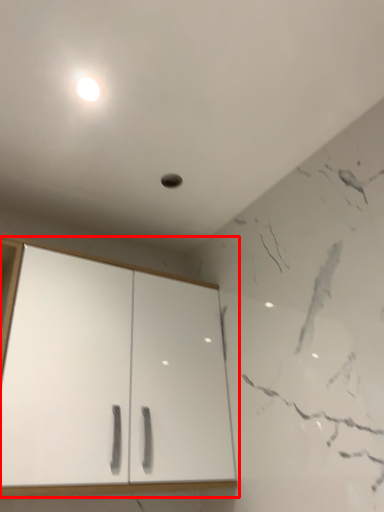
Question: Considering the relative positions of cupboard (annotated by the red box) and light in the image provided, where is cupboard (annotated by the red box) located with respect to the staircase?

Choices:
 (A) left
 (B) right

Answer: (B)